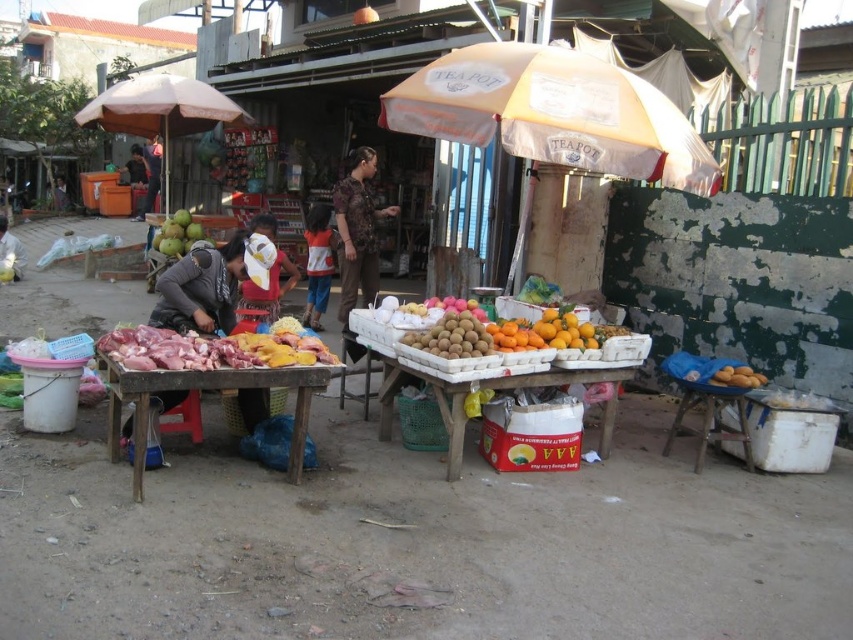
You are a customer at the market and want to approach both points in the scene. Which point, point [120,129] or point [456,460], will you reach first if you walk straight towards them?

Point [120,129] is further to the viewer than point [456,460], so you will reach point [120,129] first.